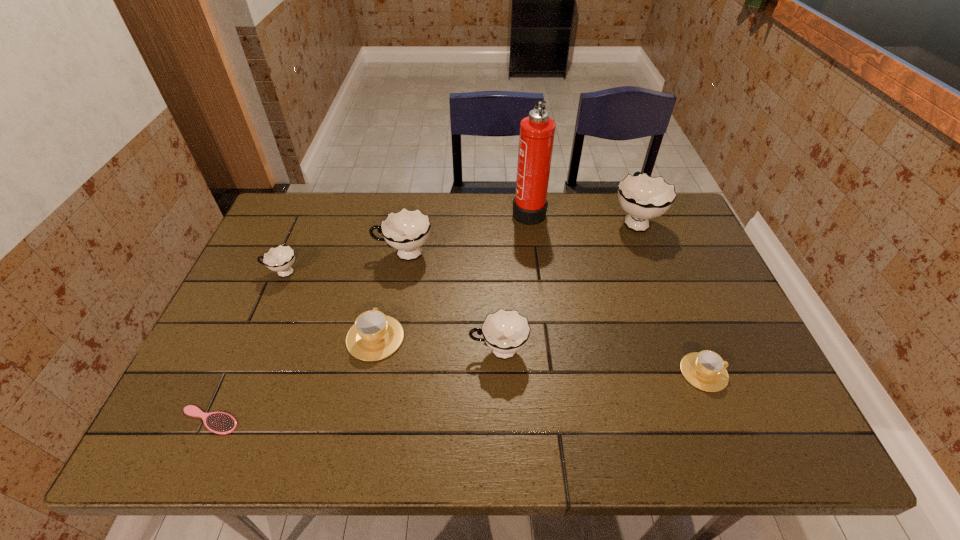
The height and width of the screenshot is (540, 960). Find the location of `vacant space that is in between the third white cup from left to right and the smallest white cup`. vacant space that is in between the third white cup from left to right and the smallest white cup is located at coordinates point(391,312).

Where is `blank region between the second biggest white cup and the fifth shortest object`? This screenshot has height=540, width=960. blank region between the second biggest white cup and the fifth shortest object is located at coordinates (451, 302).

At what (x,y) coordinates should I click in order to perform the action: click on free space that is in between the shortest object and the fourth tallest object. Please return your answer as a coordinate pair (x, y). Looking at the image, I should click on (354, 386).

Where is `vacant region between the nearest white cup and the bigger brown cup`? vacant region between the nearest white cup and the bigger brown cup is located at coordinates (437, 345).

The image size is (960, 540). I want to click on vacant area that lies between the nearest object and the leftmost cup, so click(x=246, y=346).

Locate an element on the screen. The height and width of the screenshot is (540, 960). vacant point located between the nearest white cup and the smallest white cup is located at coordinates (391, 312).

Identify which object is the fifth nearest to the hairbrush. Please provide its 2D coordinates. Your answer should be formatted as a tuple, i.e. [(x, y)], where the tuple contains the x and y coordinates of a point satisfying the conditions above.

[(536, 138)]

Where is `object that is the sixth closest to the sixth shortest object`? The height and width of the screenshot is (540, 960). object that is the sixth closest to the sixth shortest object is located at coordinates click(x=643, y=197).

This screenshot has width=960, height=540. In order to click on the closest cup to the tallest object in this screenshot , I will do `click(643, 197)`.

At what (x,y) coordinates should I click in order to perform the action: click on the fourth closest cup relative to the sixth shortest object. Please return your answer as a coordinate pair (x, y). This screenshot has width=960, height=540. Looking at the image, I should click on (643, 197).